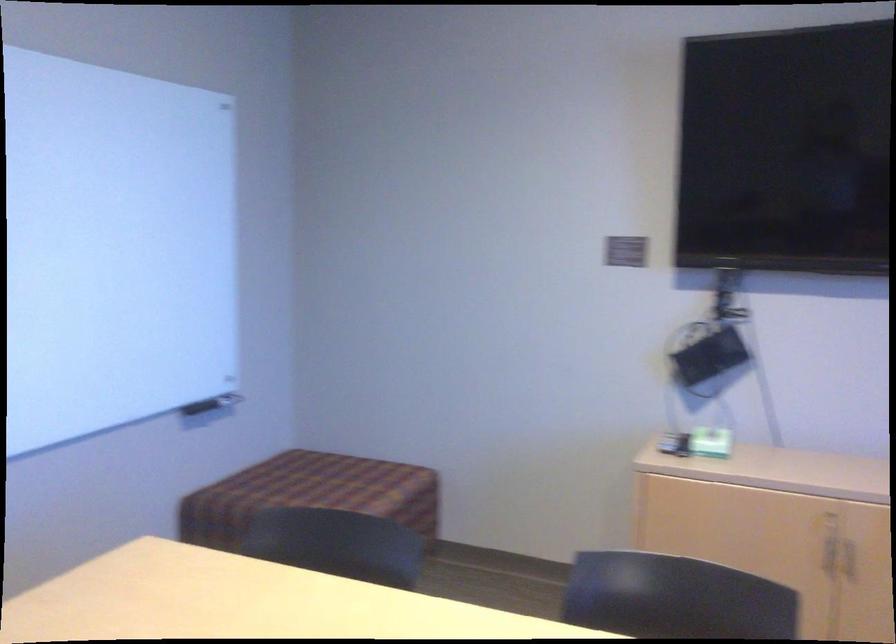
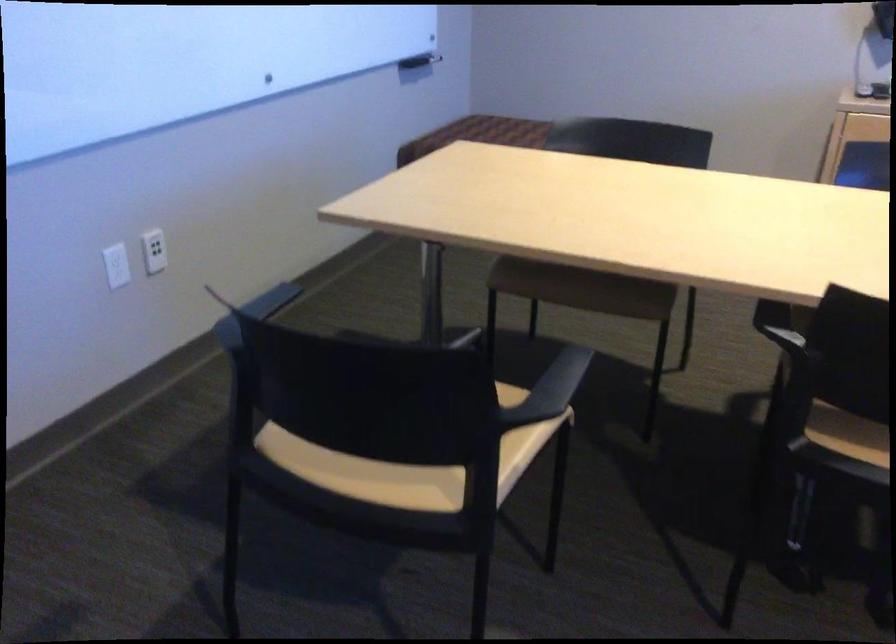
Question: How did the camera likely rotate?

Choices:
 (A) Left
 (B) Right
 (C) Up
 (D) Down

Answer: (D)